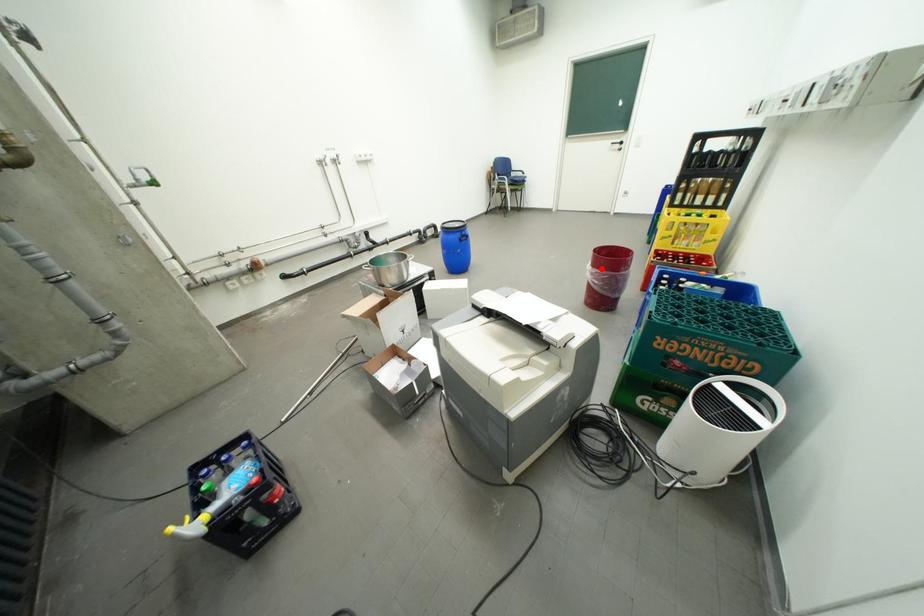
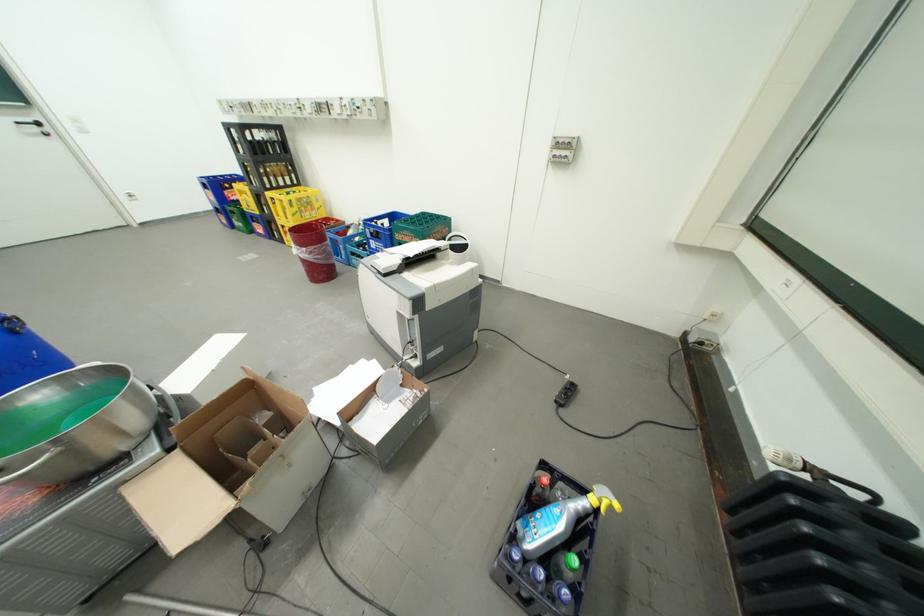
In the second image, find the point that corresponds to the highlighted location in the first image.

(314, 249)